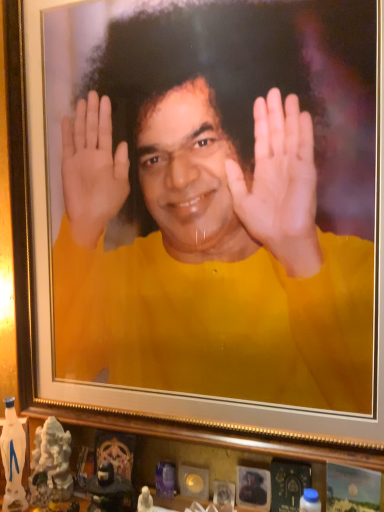
Question: Is white glossy statue at lower left, acting as the 2th toy starting from the right, bigger or smaller than matte black statue at lower center, marked as the 1th toy in a right-to-left arrangement?

Choices:
 (A) big
 (B) small

Answer: (A)

Question: Is point (38, 467) closer or farther from the camera than point (97, 509)?

Choices:
 (A) closer
 (B) farther

Answer: (B)

Question: Which of these objects is positioned closest to the matte black statue at lower center, marked as the 1th toy in a right-to-left arrangement?

Choices:
 (A) white glossy statue at lower left, which ranks as the 1th toy in left-to-right order
 (B) yellow matte shirt at center

Answer: (A)

Question: Estimate the real-world distances between objects in this image. Which object is farther from the matte black statue at lower center, marked as the 1th toy in a right-to-left arrangement?

Choices:
 (A) white glossy statue at lower left, acting as the 2th toy starting from the right
 (B) yellow matte shirt at center

Answer: (B)